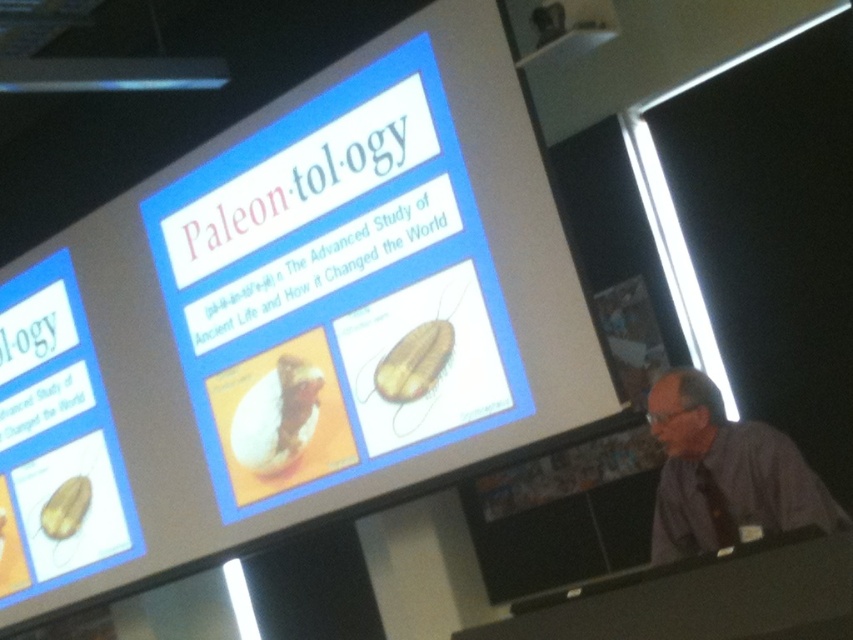
Question: Which point is farther to the camera?

Choices:
 (A) (698, 484)
 (B) (251, 300)

Answer: (B)

Question: Which point appears farthest from the camera in this image?

Choices:
 (A) (221, 360)
 (B) (723, 506)

Answer: (A)

Question: Does blue matte sign at center come behind purple shirt at lower right?

Choices:
 (A) no
 (B) yes

Answer: (B)

Question: Does blue matte sign at center appear over purple shirt at lower right?

Choices:
 (A) no
 (B) yes

Answer: (B)

Question: Does blue matte sign at center have a lesser width compared to purple shirt at lower right?

Choices:
 (A) yes
 (B) no

Answer: (B)